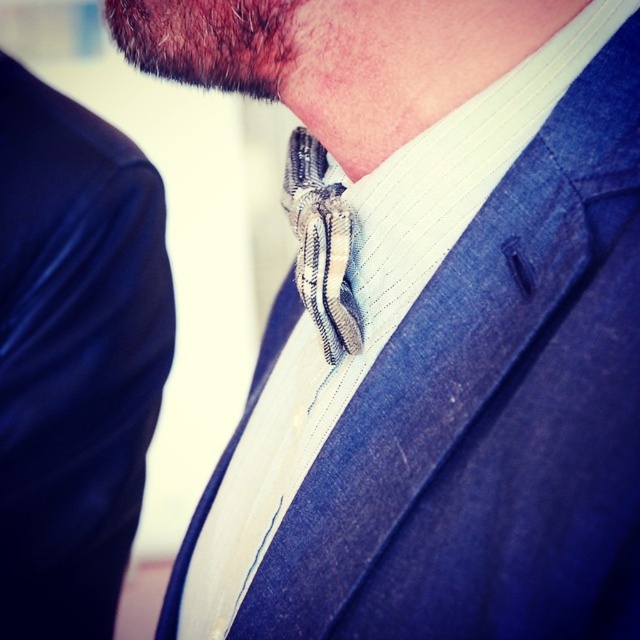
Is blue denim jacket at left below striped fabric tie at center?

Indeed, blue denim jacket at left is positioned under striped fabric tie at center.

Does blue denim jacket at left have a smaller size compared to striped fabric tie at center?

No, blue denim jacket at left is not smaller than striped fabric tie at center.

Where is `blue denim jacket at left`? This screenshot has height=640, width=640. blue denim jacket at left is located at coordinates (74, 356).

Can you confirm if white striped dress shirt at center is smaller than blue denim jacket at left?

Actually, white striped dress shirt at center might be larger than blue denim jacket at left.

Between white striped dress shirt at center and blue denim jacket at left, which one is positioned lower?

blue denim jacket at left is lower down.

Is point (508, 186) closer to camera compared to point (24, 186)?

Yes, it is in front of point (24, 186).

This screenshot has height=640, width=640. Find the location of `white striped dress shirt at center`. white striped dress shirt at center is located at coordinates (432, 324).

Based on the photo, does white striped dress shirt at center have a smaller size compared to striped fabric tie at center?

No, white striped dress shirt at center is not smaller than striped fabric tie at center.

This screenshot has height=640, width=640. In order to click on white striped dress shirt at center in this screenshot , I will do `click(432, 324)`.

I want to click on white striped dress shirt at center, so click(432, 324).